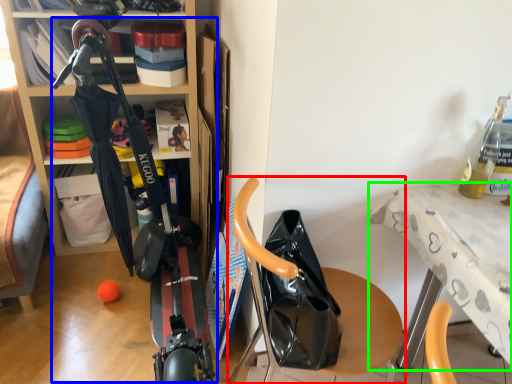
Question: Which is farther away from furniture (highlighted by a red box)? sport equipment (highlighted by a blue box) or table (highlighted by a green box)?

Choices:
 (A) sport equipment
 (B) table

Answer: (A)